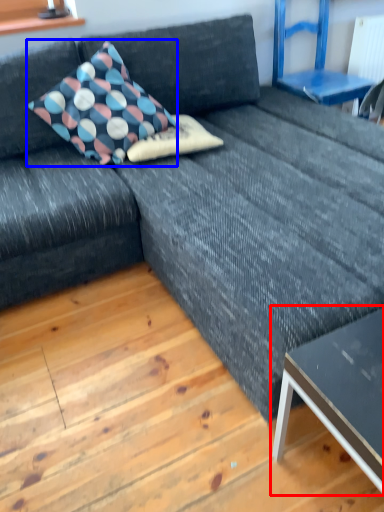
Question: Which of the following is the farthest to the observer, table (highlighted by a red box) or pillow (highlighted by a blue box)?

Choices:
 (A) table
 (B) pillow

Answer: (B)